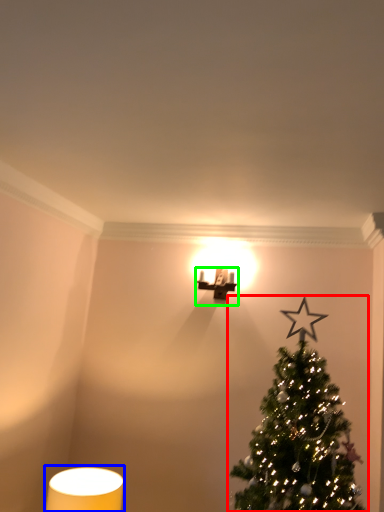
Question: Which object is positioned farthest from christmas tree (highlighted by a red box)? Select from table lamp (highlighted by a blue box) and table lamp (highlighted by a green box).

Choices:
 (A) table lamp
 (B) table lamp

Answer: (B)